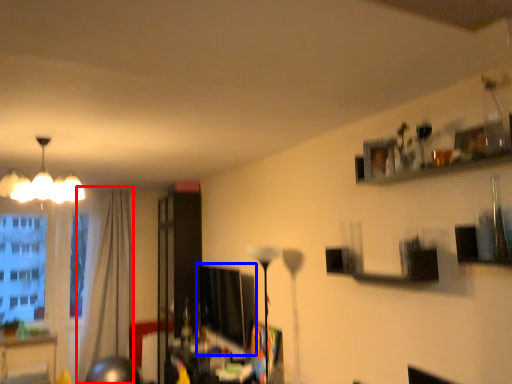
Question: Which object is further to the camera taking this photo, curtain (highlighted by a red box) or computer monitor (highlighted by a blue box)?

Choices:
 (A) curtain
 (B) computer monitor

Answer: (A)